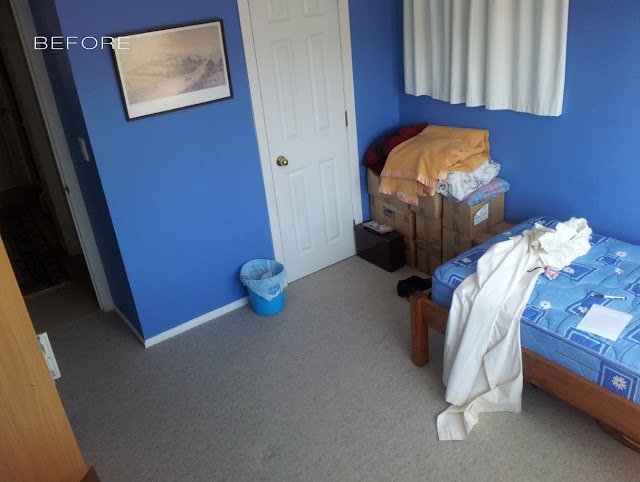
Where is `bookshelf`? This screenshot has height=482, width=640. bookshelf is located at coordinates (33, 438).